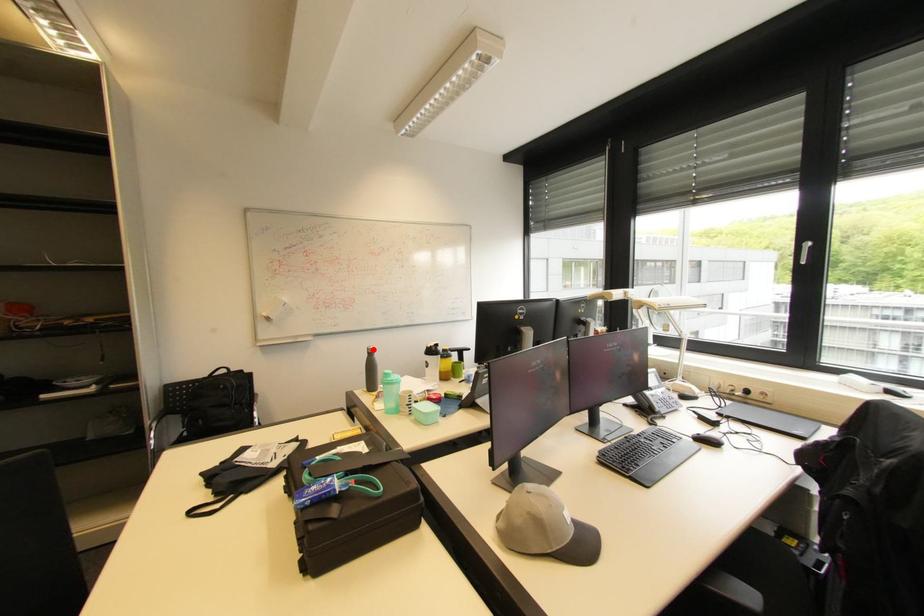
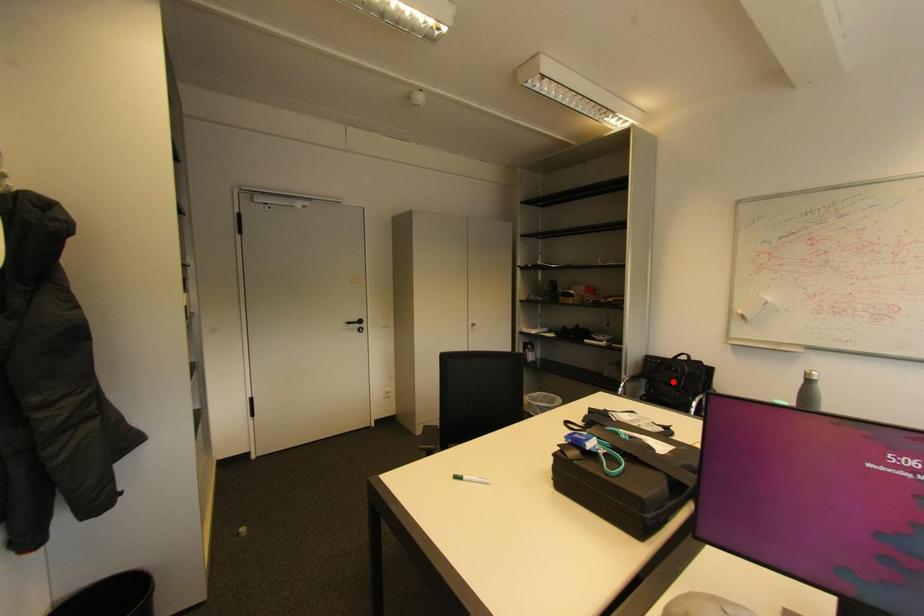
I am providing you with two images of the same scene from different viewpoints. A red point is marked on the first image and another point is marked on the second image. Are the points marked in image1 and image2 representing the same 3D position?

No